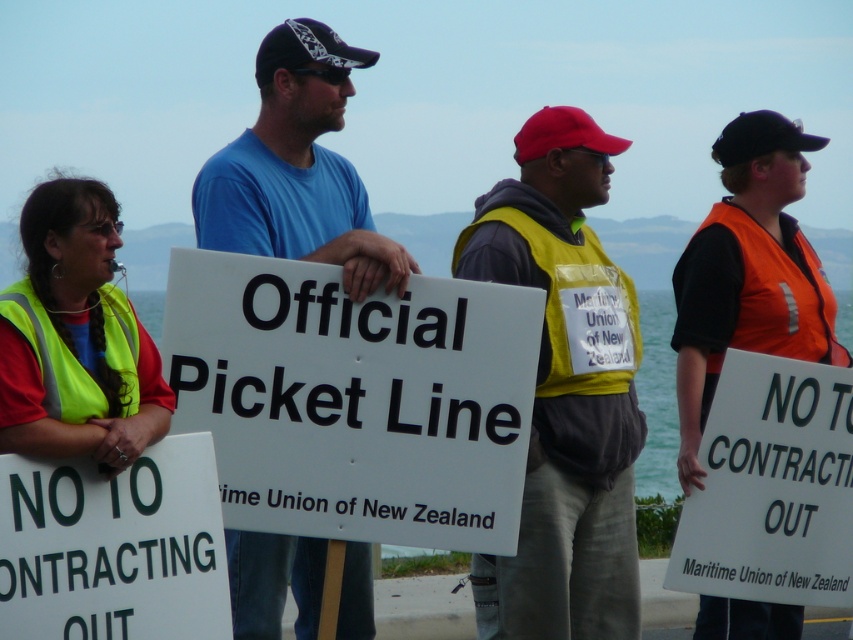
Question: Which point is closer to the camera?

Choices:
 (A) (548, 320)
 (B) (555, 296)
 (C) (350, 298)
 (D) (123, 513)

Answer: (D)

Question: Can you confirm if white plastic sign at center is bigger than white paper sign at center?

Choices:
 (A) no
 (B) yes

Answer: (B)

Question: Which of these objects is positioned farthest from the white paper sign at right?

Choices:
 (A) white paper sign at center
 (B) yellow reflective vest at center
 (C) blue t-shirt at center
 (D) orange reflective vest at center

Answer: (A)

Question: Is the position of white paper sign at right less distant than that of orange reflective vest at center?

Choices:
 (A) no
 (B) yes

Answer: (B)

Question: Among these objects, which one is nearest to the camera?

Choices:
 (A) white paper sign at center
 (B) yellow reflective vest at center

Answer: (A)

Question: Is blue t-shirt at center to the left of white paper sign at center from the viewer's perspective?

Choices:
 (A) no
 (B) yes

Answer: (A)